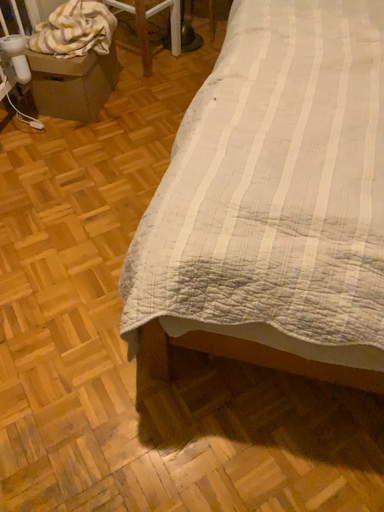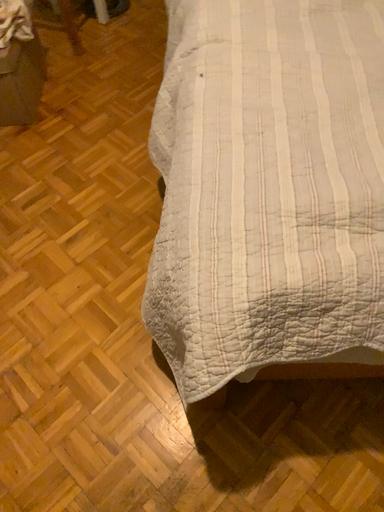
Question: How did the camera likely rotate when shooting the video?

Choices:
 (A) rotated right
 (B) rotated left

Answer: (A)